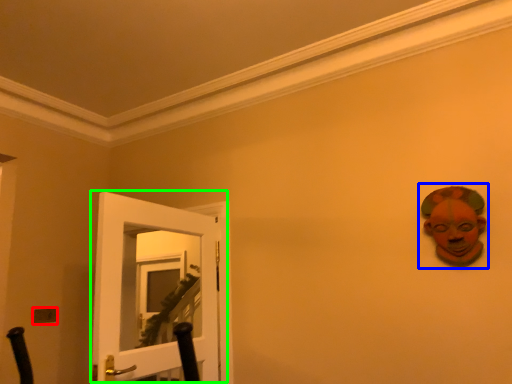
Question: Which is nearer to the light switch (highlighted by a red box)? person (highlighted by a blue box) or door (highlighted by a green box).

Choices:
 (A) person
 (B) door

Answer: (B)